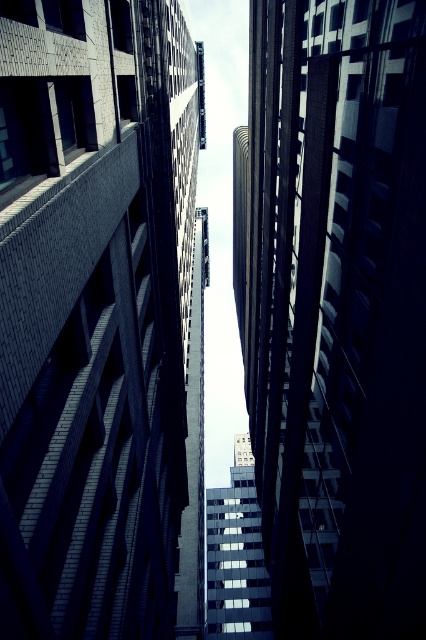
Question: Can you confirm if brick wall at center is bigger than smooth glass skyscraper at center?

Choices:
 (A) yes
 (B) no

Answer: (A)

Question: Is brick wall at center positioned at the back of smooth glass skyscraper at center?

Choices:
 (A) no
 (B) yes

Answer: (A)

Question: Is brick wall at center positioned before smooth glass skyscraper at center?

Choices:
 (A) yes
 (B) no

Answer: (A)